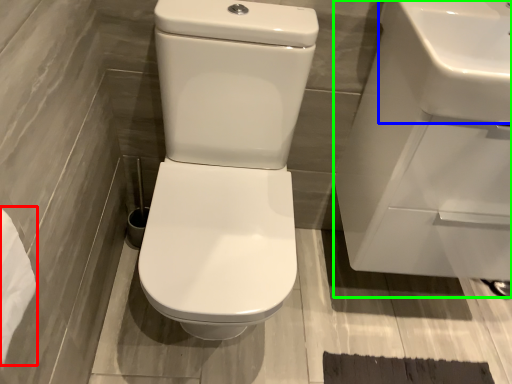
Question: Estimate the real-world distances between objects in this image. Which object is farther from toilet paper (highlighted by a red box), sink (highlighted by a blue box) or sink (highlighted by a green box)?

Choices:
 (A) sink
 (B) sink

Answer: (B)